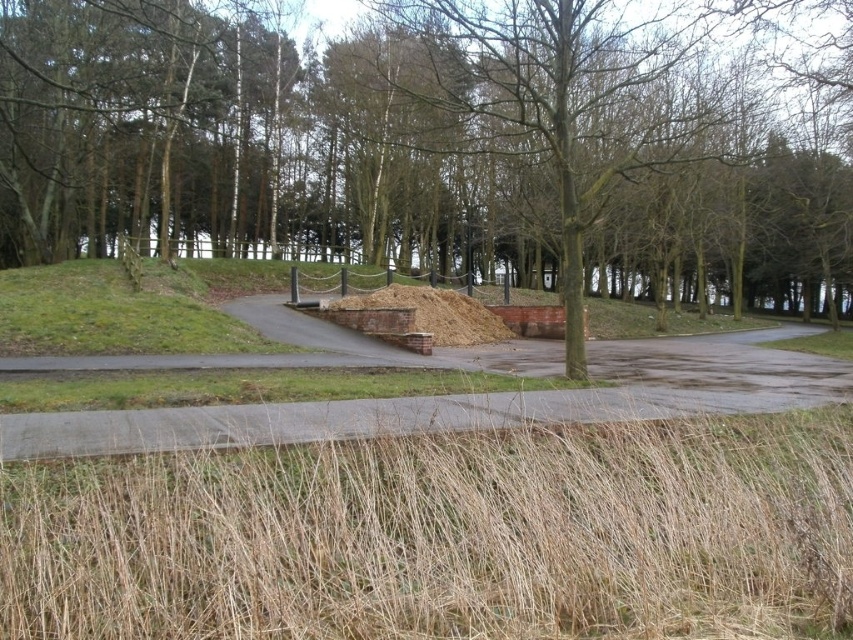
Consider the image. You are standing at the entrance of the park and see the dry grass at lower center and the brown woodpile at center. Which object is nearer to you?

The dry grass at lower center is closer to the viewer than the brown woodpile at center.

Based on the photo, you are a park maintenance worker who needs to place a new compost bin that is 2 meters wide. You see the brown bark tree at center and the brown woodpile at center. Which location can accommodate the compost bin?

The brown bark tree at center is bigger than the brown woodpile at center, so the compost bin that is 2 meters wide can be placed at the location of the brown bark tree at center.